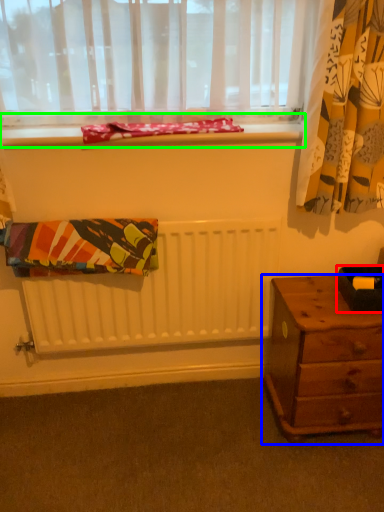
Question: Based on their relative distances, which object is farther from box (highlighted by a red box)? Choose from nightstand (highlighted by a blue box) and window sill (highlighted by a green box).

Choices:
 (A) nightstand
 (B) window sill

Answer: (B)